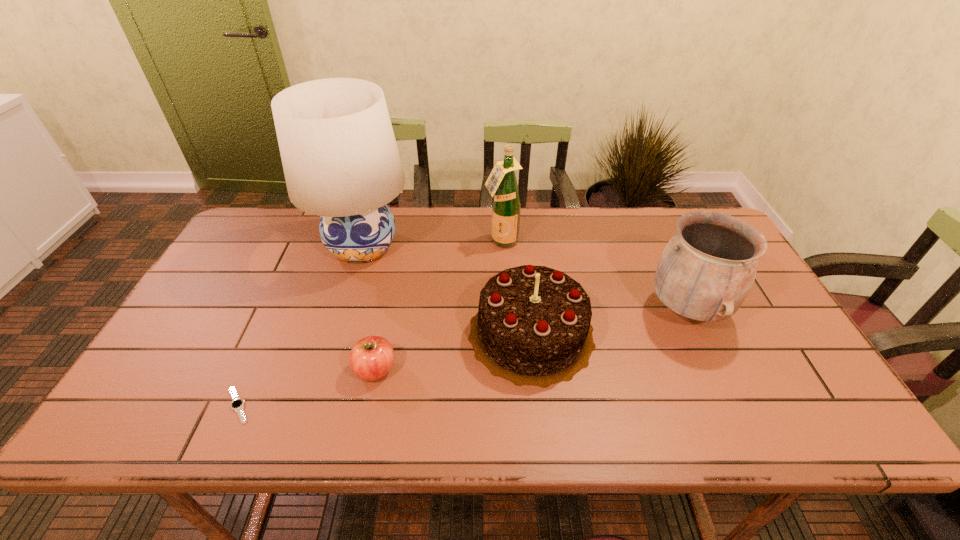
I want to click on free space at the right edge, so click(753, 381).

In the image, there is a desktop. Where is `free space at the near left corner`? Image resolution: width=960 pixels, height=540 pixels. free space at the near left corner is located at coordinates (175, 410).

The width and height of the screenshot is (960, 540). In order to click on free location at the far right corner in this screenshot , I will do `click(675, 225)`.

Where is `free point between the fifth shortest object and the apple`? free point between the fifth shortest object and the apple is located at coordinates (439, 306).

The image size is (960, 540). I want to click on free space between the fifth tallest object and the second tallest object, so click(439, 306).

Locate an element on the screen. The width and height of the screenshot is (960, 540). empty space that is in between the tallest object and the second shortest object is located at coordinates (369, 308).

Locate an element on the screen. Image resolution: width=960 pixels, height=540 pixels. free space between the fifth shortest object and the rightmost object is located at coordinates (594, 275).

At what (x,y) coordinates should I click in order to perform the action: click on vacant area that lies between the birthday cake and the apple. Please return your answer as a coordinate pair (x, y). Image resolution: width=960 pixels, height=540 pixels. Looking at the image, I should click on (453, 352).

Locate an element on the screen. free space between the second tallest object and the lampshade is located at coordinates 432,244.

Where is `vacant area that lies between the watch and the apple`? vacant area that lies between the watch and the apple is located at coordinates (306, 388).